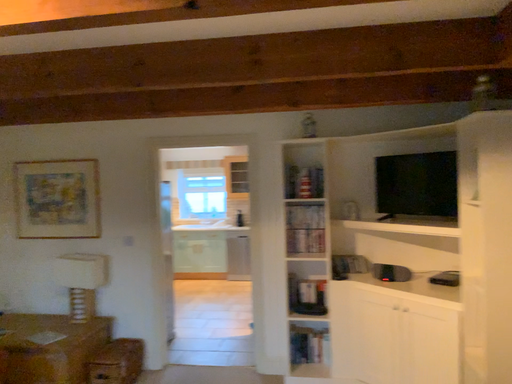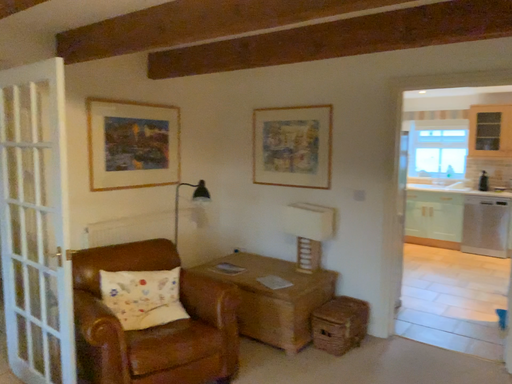
Question: How did the camera likely rotate when shooting the video?

Choices:
 (A) rotated right
 (B) rotated left

Answer: (B)